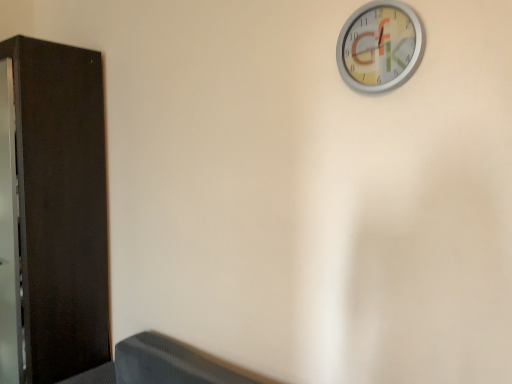
Question: Considering their positions, is dark wood dresser at left located in front of or behind metallic silver clock at upper right?

Choices:
 (A) behind
 (B) front

Answer: (A)

Question: Based on their sizes in the image, would you say dark wood dresser at left is bigger or smaller than metallic silver clock at upper right?

Choices:
 (A) big
 (B) small

Answer: (A)

Question: Visually, is dark wood dresser at left positioned to the left or to the right of metallic silver clock at upper right?

Choices:
 (A) left
 (B) right

Answer: (A)

Question: In terms of height, does metallic silver clock at upper right look taller or shorter compared to dark wood dresser at left?

Choices:
 (A) short
 (B) tall

Answer: (A)

Question: Is point coord(346,39) closer or farther from the camera than point coord(100,218)?

Choices:
 (A) farther
 (B) closer

Answer: (B)

Question: Choose the correct answer: Is metallic silver clock at upper right inside dark wood dresser at left or outside it?

Choices:
 (A) inside
 (B) outside

Answer: (B)

Question: Is metallic silver clock at upper right bigger or smaller than dark wood dresser at left?

Choices:
 (A) small
 (B) big

Answer: (A)